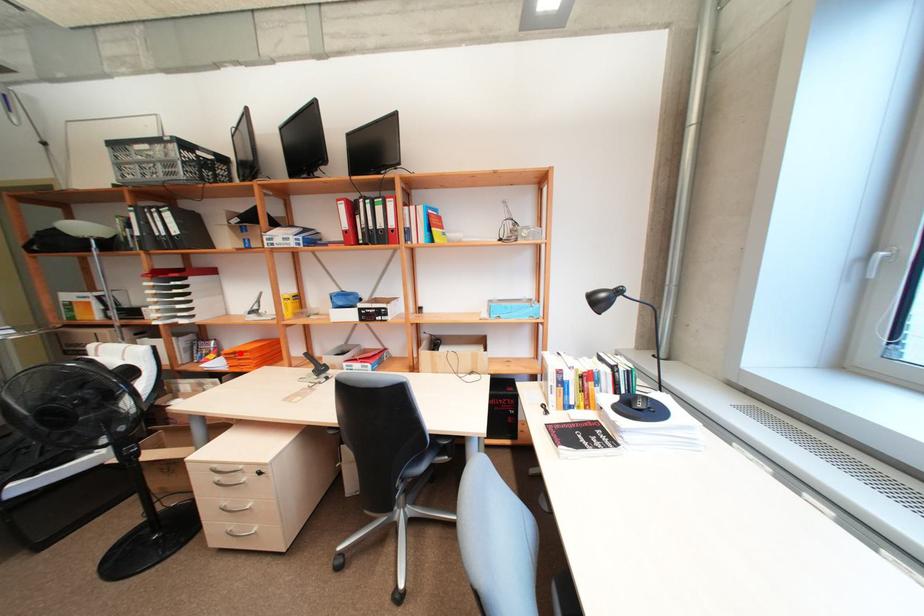
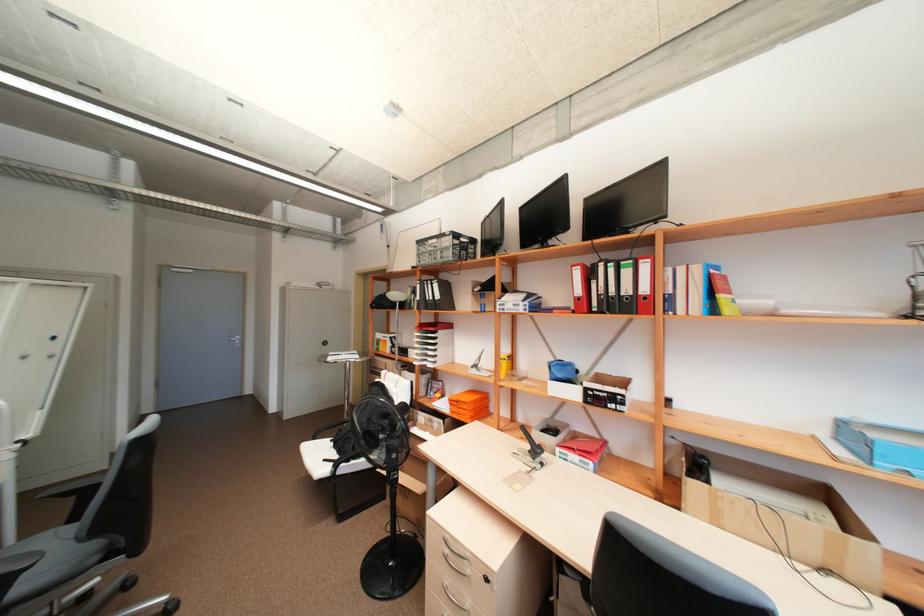
Find the pixel in the second image that matches the highlighted location in the first image.

(463, 400)